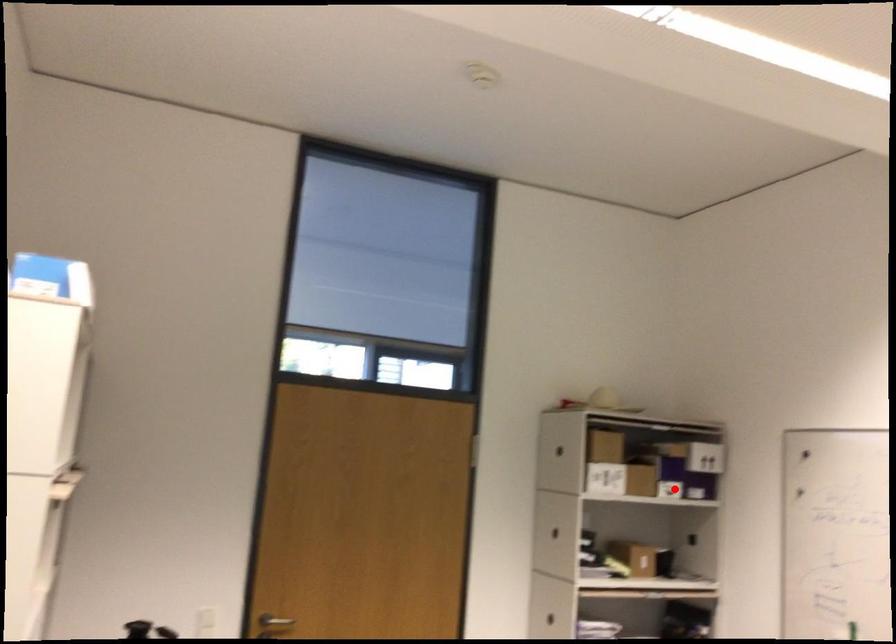
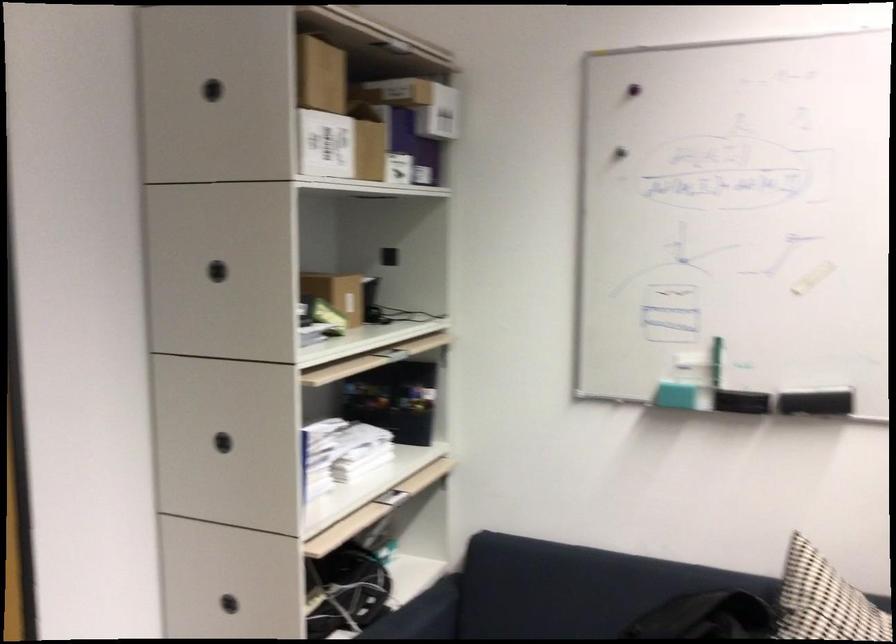
Locate, in the second image, the point that corresponds to the highlighted location in the first image.

(398, 167)